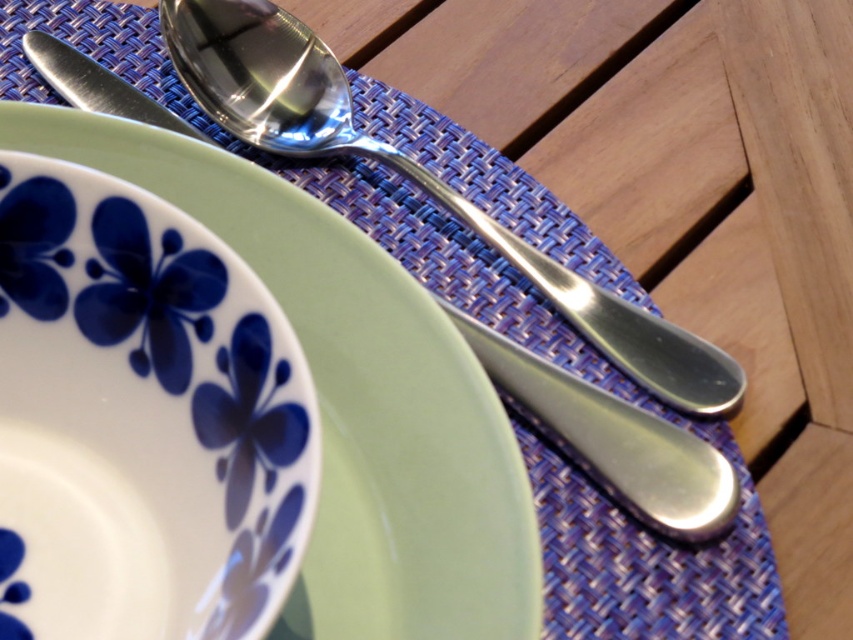
Question: Is green ceramic plate at upper left further to the viewer compared to polished metal spoon at upper center?

Choices:
 (A) yes
 (B) no

Answer: (B)

Question: Does green ceramic plate at upper left appear on the left side of polished metal spoon at upper center?

Choices:
 (A) no
 (B) yes

Answer: (B)

Question: Does green ceramic plate at upper left appear on the right side of polished metal spoon at upper center?

Choices:
 (A) no
 (B) yes

Answer: (A)

Question: Among these points, which one is farthest from the camera?

Choices:
 (A) (329, 116)
 (B) (407, 524)

Answer: (A)